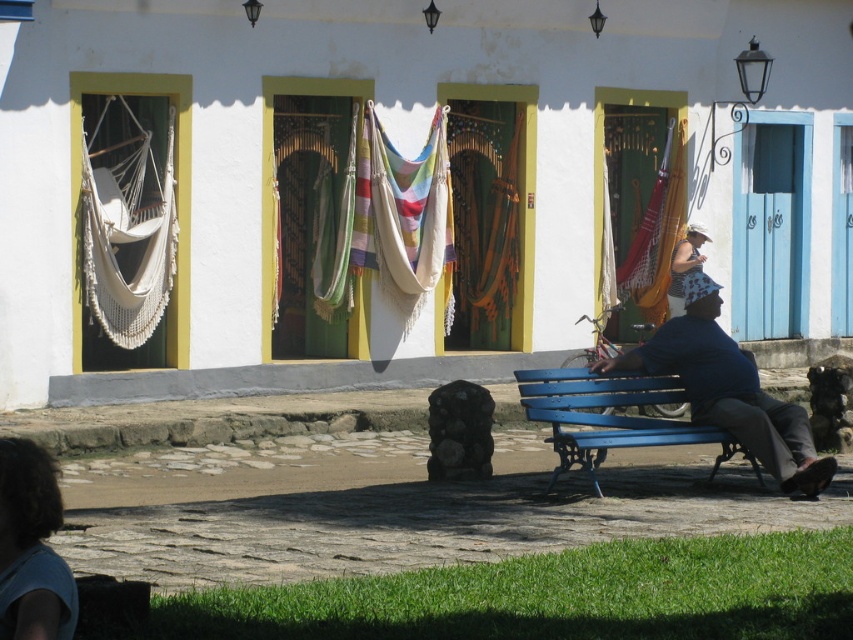
Which is behind, point (596, 396) or point (640, 269)?

The point (640, 269) is more distant.

In order to click on blue painted wood bench at lower right in this screenshot , I will do `click(612, 417)`.

Locate an element on the screen. blue painted wood bench at lower right is located at coordinates (612, 417).

Which of these two, blue fabric shirt at lower right or light brown hair at lower left, stands taller?

blue fabric shirt at lower right

Which of these two, blue fabric shirt at lower right or light brown hair at lower left, stands shorter?

light brown hair at lower left is shorter.

Does point (688, 349) lie behind point (57, 593)?

That is True.

This screenshot has width=853, height=640. I want to click on blue fabric shirt at lower right, so click(x=728, y=388).

Find the location of `blue fabric shirt at lower right`. blue fabric shirt at lower right is located at coordinates (728, 388).